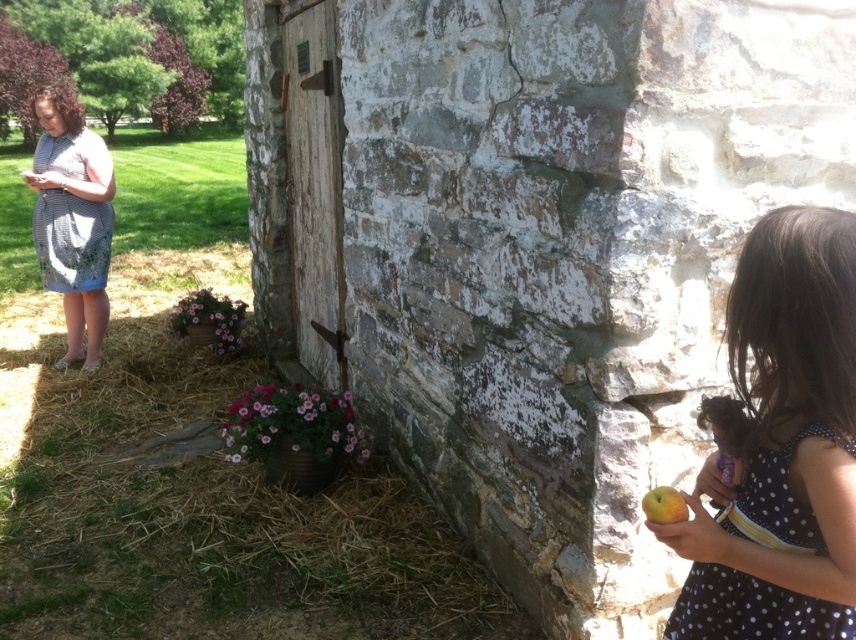
Does brown straw at lower left appear on the right side of polka dot dress at right?

No, brown straw at lower left is not to the right of polka dot dress at right.

In the scene shown: Is brown straw at lower left positioned before polka dot dress at right?

No.

Does point (165, 492) come closer to viewer compared to point (807, 628)?

No, (165, 492) is behind (807, 628).

You are a GUI agent. You are given a task and a screenshot of the screen. Output one action in this format:
    pyautogui.click(x=<x>, y=<y>)
    Task: Click on the brown straw at lower left
    
    Given the screenshot: What is the action you would take?
    pyautogui.click(x=212, y=522)

Who is taller, polka dot dress at right or yellow matte apple at lower right?

polka dot dress at right

Is polka dot dress at right taller than yellow matte apple at lower right?

Yes.

Image resolution: width=856 pixels, height=640 pixels. Find the location of `polka dot dress at right`. polka dot dress at right is located at coordinates pyautogui.click(x=782, y=445).

Where is `polka dot dress at right`? Image resolution: width=856 pixels, height=640 pixels. polka dot dress at right is located at coordinates (782, 445).

Between brown straw at lower left and yellow matte apple at lower right, which one is positioned lower?

Positioned lower is brown straw at lower left.

Is point (194, 520) positioned behind point (670, 496)?

Yes, point (194, 520) is farther from viewer.

At what (x,y) coordinates should I click in order to perform the action: click on brown straw at lower left. Please return your answer as a coordinate pair (x, y). Looking at the image, I should click on (212, 522).